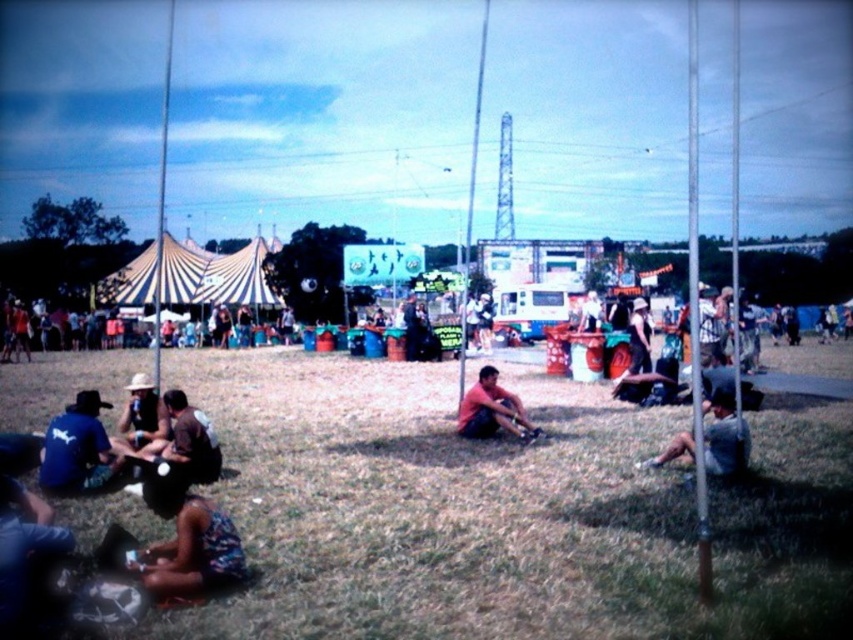
Is point (117, 461) less distant than point (132, 436)?

That is True.

Measure the distance between blue fabric shirt at lower left and camera.

18.02 meters

The height and width of the screenshot is (640, 853). I want to click on blue fabric shirt at lower left, so click(x=78, y=449).

The height and width of the screenshot is (640, 853). Find the location of `blue fabric shirt at lower left`. blue fabric shirt at lower left is located at coordinates tap(78, 449).

Does green grass at lower center have a lesser width compared to floral dress at lower left?

Incorrect, green grass at lower center's width is not less than floral dress at lower left's.

Who is higher up, green grass at lower center or floral dress at lower left?

green grass at lower center is above.

What do you see at coordinates (503, 509) in the screenshot? The height and width of the screenshot is (640, 853). I see `green grass at lower center` at bounding box center [503, 509].

This screenshot has height=640, width=853. In order to click on green grass at lower center in this screenshot , I will do `click(503, 509)`.

Is dark gray fabric shirt at lower right in front of matte red shirt at center?

Yes.

Who is more forward, (676, 456) or (486, 378)?

Point (676, 456)

The width and height of the screenshot is (853, 640). Find the location of `dark gray fabric shirt at lower right`. dark gray fabric shirt at lower right is located at coordinates (724, 435).